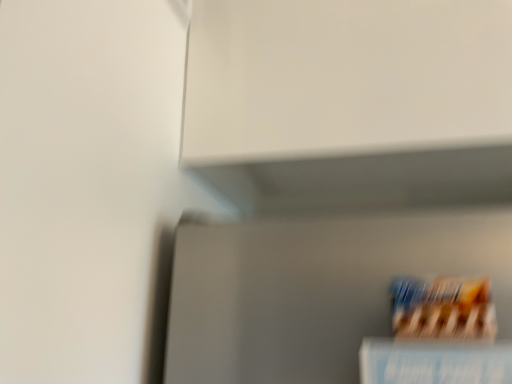
At what (x,y) coordinates should I click in order to perform the action: click on blue cardboard cereal at lower right. Please return your answer as a coordinate pair (x, y). This screenshot has width=512, height=384. Looking at the image, I should click on (443, 308).

What do you see at coordinates (443, 308) in the screenshot? The image size is (512, 384). I see `blue cardboard cereal at lower right` at bounding box center [443, 308].

Where is `blue paper book at lower right`? The height and width of the screenshot is (384, 512). blue paper book at lower right is located at coordinates (434, 362).

What do you see at coordinates (434, 362) in the screenshot?
I see `blue paper book at lower right` at bounding box center [434, 362].

In order to click on blue cardboard cereal at lower right in this screenshot , I will do `click(443, 308)`.

Is blue paper book at lower right to the left of blue cardboard cereal at lower right from the viewer's perspective?

Indeed, blue paper book at lower right is positioned on the left side of blue cardboard cereal at lower right.

Which object is closer to the camera taking this photo, blue paper book at lower right or blue cardboard cereal at lower right?

Positioned in front is blue paper book at lower right.

Which is nearer, (x=383, y=371) or (x=407, y=327)?

Clearly, point (x=383, y=371) is closer to the camera than point (x=407, y=327).

From the image's perspective, relative to blue cardboard cereal at lower right, is blue paper book at lower right above or below?

blue paper book at lower right is situated lower than blue cardboard cereal at lower right in the image.

From a real-world perspective, who is located higher, blue paper book at lower right or blue cardboard cereal at lower right?

blue cardboard cereal at lower right, from a real-world perspective.

Looking at their sizes, would you say blue paper book at lower right is wider or thinner than blue cardboard cereal at lower right?

blue paper book at lower right is wider than blue cardboard cereal at lower right.

In terms of height, does blue paper book at lower right look taller or shorter compared to blue cardboard cereal at lower right?

Considering their sizes, blue paper book at lower right has more height than blue cardboard cereal at lower right.

Which of these two, blue paper book at lower right or blue cardboard cereal at lower right, is bigger?

Bigger between the two is blue paper book at lower right.

Is blue cardboard cereal at lower right inside blue paper book at lower right?

No, blue cardboard cereal at lower right is not a part of blue paper book at lower right.

Is blue paper book at lower right far from blue cardboard cereal at lower right?

No, blue paper book at lower right is in close proximity to blue cardboard cereal at lower right.

Could you tell me if blue paper book at lower right is facing blue cardboard cereal at lower right?

No, blue paper book at lower right is not facing towards blue cardboard cereal at lower right.

How different are the orientations of blue paper book at lower right and blue cardboard cereal at lower right in degrees?

0.000474 degrees.

Find the location of a particular element. This screenshot has width=512, height=384. cereal behind the blue paper book at lower right is located at coordinates (443, 308).

Is blue cardboard cereal at lower right to the right of blue paper book at lower right from the viewer's perspective?

Indeed, blue cardboard cereal at lower right is positioned on the right side of blue paper book at lower right.

From the picture: Is the depth of blue cardboard cereal at lower right less than that of blue paper book at lower right?

No, the depth of blue cardboard cereal at lower right is greater than that of blue paper book at lower right.

Considering the positions of points (487, 333) and (464, 351), is point (487, 333) farther from camera compared to point (464, 351)?

No, (487, 333) is closer to viewer.

From the image's perspective, which one is positioned lower, blue cardboard cereal at lower right or blue paper book at lower right?

blue paper book at lower right.

From a real-world perspective, is blue cardboard cereal at lower right below blue paper book at lower right?

No, from a real-world perspective, blue cardboard cereal at lower right is not under blue paper book at lower right.

Which of these two, blue cardboard cereal at lower right or blue paper book at lower right, is wider?

With larger width is blue paper book at lower right.

Does blue cardboard cereal at lower right have a greater height compared to blue paper book at lower right?

No, blue cardboard cereal at lower right is not taller than blue paper book at lower right.

Considering the sizes of objects blue cardboard cereal at lower right and blue paper book at lower right in the image provided, who is bigger, blue cardboard cereal at lower right or blue paper book at lower right?

blue paper book at lower right.

From the picture: Is blue cardboard cereal at lower right situated inside blue paper book at lower right or outside?

blue cardboard cereal at lower right is spatially situated outside blue paper book at lower right.

Would you say blue cardboard cereal at lower right is a long distance from blue paper book at lower right?

No, blue cardboard cereal at lower right is not far from blue paper book at lower right.

Is blue cardboard cereal at lower right positioned with its back to blue paper book at lower right?

No, blue cardboard cereal at lower right's orientation is not away from blue paper book at lower right.

Locate an element on the screen. book below the blue cardboard cereal at lower right (from a real-world perspective) is located at coordinates (434, 362).

The image size is (512, 384). I want to click on book located on the left of blue cardboard cereal at lower right, so click(x=434, y=362).

The image size is (512, 384). I want to click on cereal above the blue paper book at lower right (from a real-world perspective), so click(443, 308).